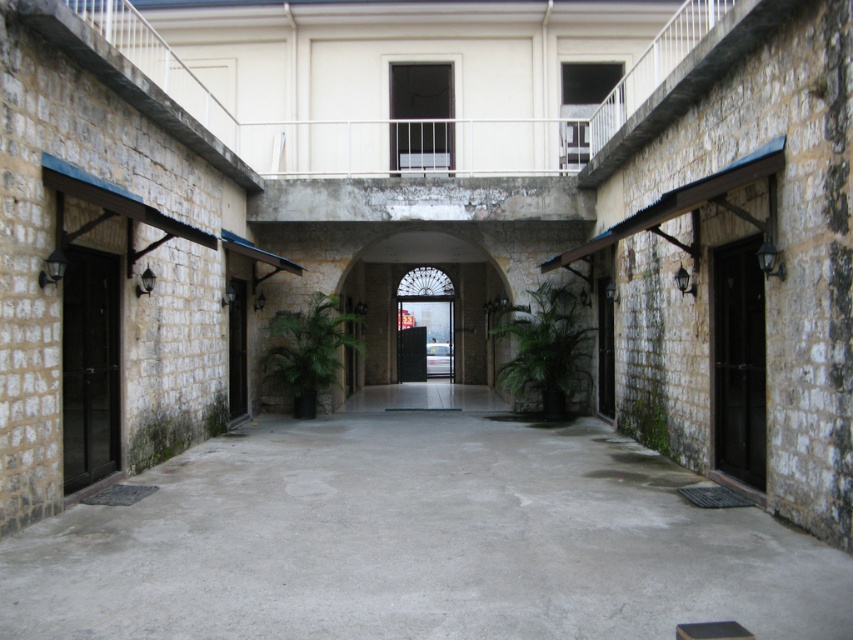
Question: Which of the following is the closest to the observer?

Choices:
 (A) black glass door at right
 (B) black matte door at left
 (C) smooth concrete floor at center
 (D) brown wooden door at center

Answer: (C)

Question: Is smooth concrete floor at center below smooth stone archway at center?

Choices:
 (A) no
 (B) yes

Answer: (B)

Question: Does black glass door at right appear on the right side of brown wooden door at center?

Choices:
 (A) no
 (B) yes

Answer: (B)

Question: Which object is farther from the camera taking this photo?

Choices:
 (A) brown wooden door at center
 (B) black glass door at right

Answer: (A)

Question: Considering the relative positions of black matte door at left and black glass door at right in the image provided, where is black matte door at left located with respect to black glass door at right?

Choices:
 (A) above
 (B) below

Answer: (B)

Question: Which of the following is the farthest from the observer?

Choices:
 (A) smooth concrete floor at center
 (B) brown wooden door at center
 (C) smooth stone archway at center
 (D) black matte door at left

Answer: (C)